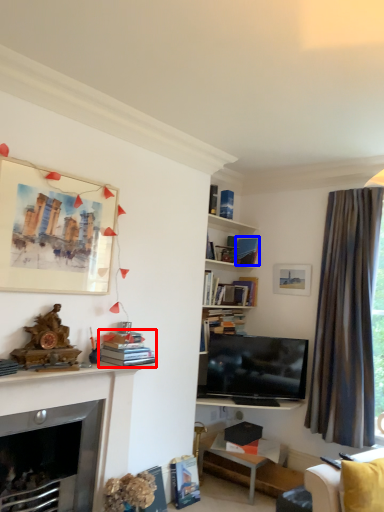
Question: Which of the following is the closest to the observer, book (highlighted by a red box) or book (highlighted by a blue box)?

Choices:
 (A) book
 (B) book

Answer: (A)